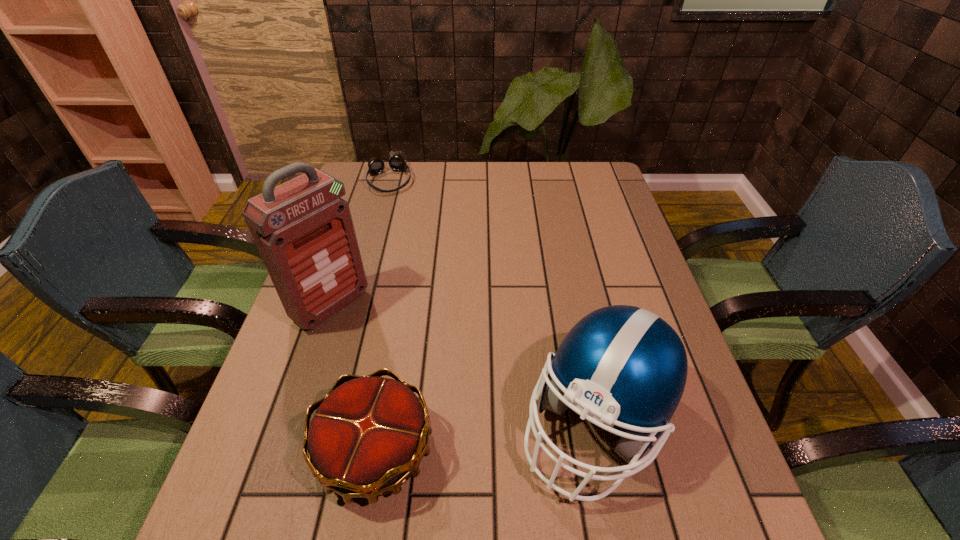
Locate an element on the screen. The image size is (960, 540). unoccupied area between the second farthest object and the goggles is located at coordinates [x=360, y=242].

You are a GUI agent. You are given a task and a screenshot of the screen. Output one action in this format:
    pyautogui.click(x=<x>, y=<y>)
    Task: Click on the free space between the shortest object and the third shortest object
    The image size is (960, 540).
    Given the screenshot: What is the action you would take?
    pyautogui.click(x=492, y=301)

The height and width of the screenshot is (540, 960). Identify the location of free space between the crown and the shortest object. coord(382,315).

At what (x,y) coordinates should I click in order to perform the action: click on blank region between the crown and the shortest object. Please return your answer as a coordinate pair (x, y). The width and height of the screenshot is (960, 540). Looking at the image, I should click on (382, 315).

Locate an element on the screen. unoccupied area between the rightmost object and the goggles is located at coordinates (492, 301).

You are a GUI agent. You are given a task and a screenshot of the screen. Output one action in this format:
    pyautogui.click(x=<x>, y=<y>)
    Task: Click on the free area in between the football helmet and the tallest object
    
    Given the screenshot: What is the action you would take?
    pyautogui.click(x=464, y=364)

Where is `object that is the third closest to the third nearest object`? object that is the third closest to the third nearest object is located at coordinates (396, 161).

Where is `the closest object to the football helmet`? Image resolution: width=960 pixels, height=540 pixels. the closest object to the football helmet is located at coordinates (366, 439).

Identify the location of free point that satisfies the following two spatial constraints: 1. on the front side of the crown; 2. on the right side of the first-aid kit. (284, 450).

At what (x,y) coordinates should I click in order to perform the action: click on free space that satisfies the following two spatial constraints: 1. on the front side of the shortest object; 2. on the left side of the second shortest object. Please return your answer as a coordinate pair (x, y). Looking at the image, I should click on (315, 450).